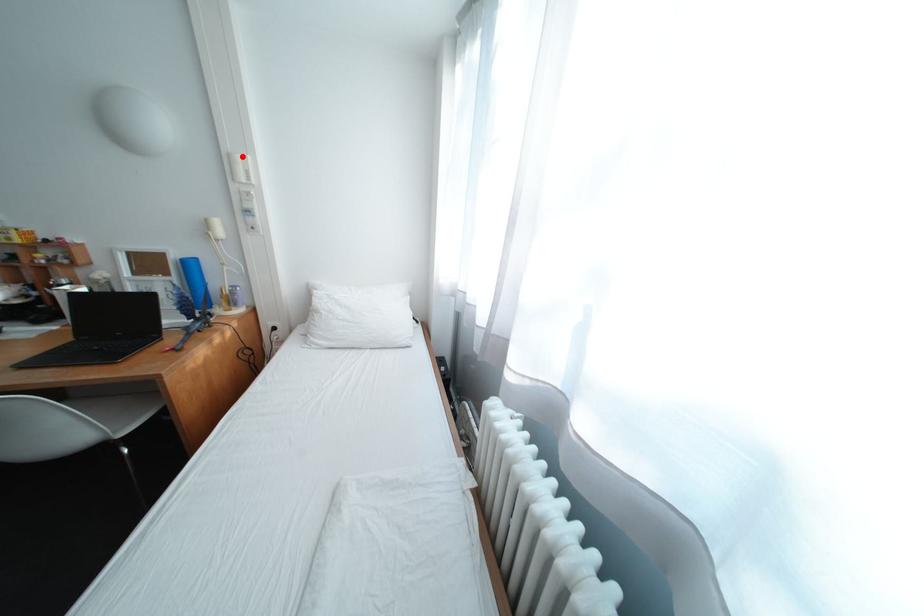
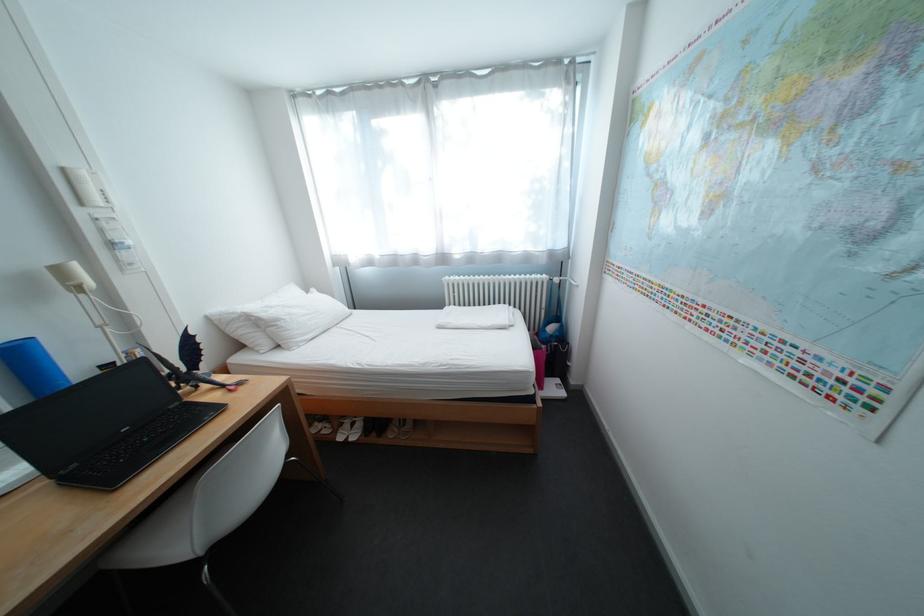
Locate, in the second image, the point that corresponds to the highlighted location in the first image.

(76, 171)